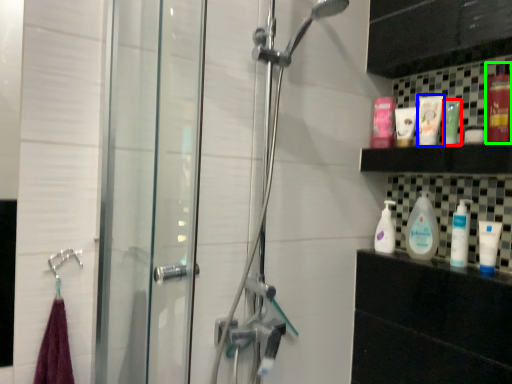
Question: Which object is the farthest from mouthwash (highlighted by a red box)? Choose among these: toiletry (highlighted by a blue box) or mouthwash (highlighted by a green box).

Choices:
 (A) toiletry
 (B) mouthwash

Answer: (B)